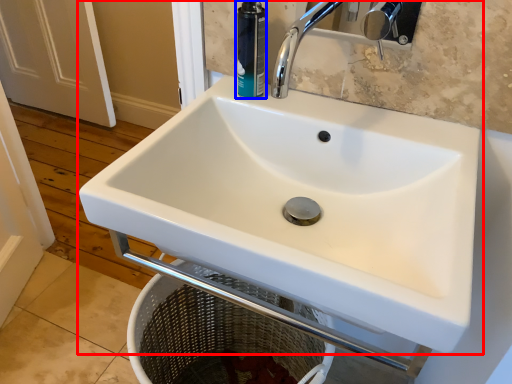
Question: Which object is closer to the camera taking this photo, sink (highlighted by a red box) or toiletry (highlighted by a blue box)?

Choices:
 (A) sink
 (B) toiletry

Answer: (A)